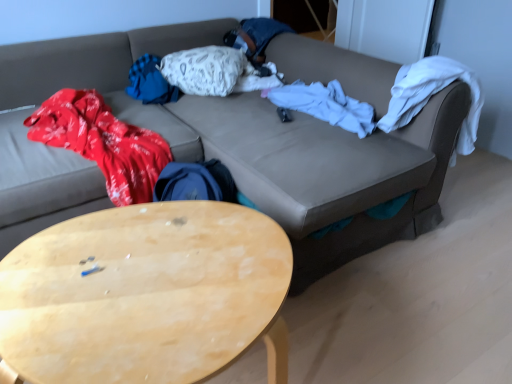
Locate an element on the screen. Image resolution: width=512 pixels, height=384 pixels. blank space situated above light wood/wooden coffee table at lower left (from a real-world perspective) is located at coordinates (151, 273).